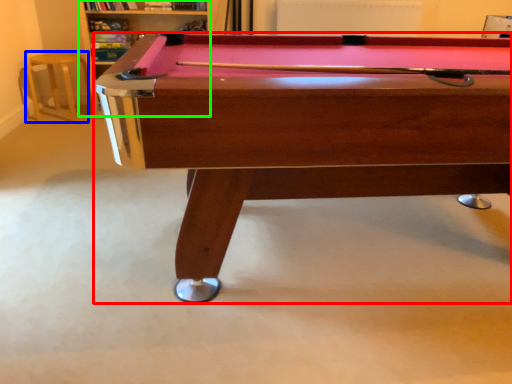
Question: Estimate the real-world distances between objects in this image. Which object is farther from billiard table (highlighted by a red box), bar stool (highlighted by a blue box) or shelf (highlighted by a green box)?

Choices:
 (A) bar stool
 (B) shelf

Answer: (A)